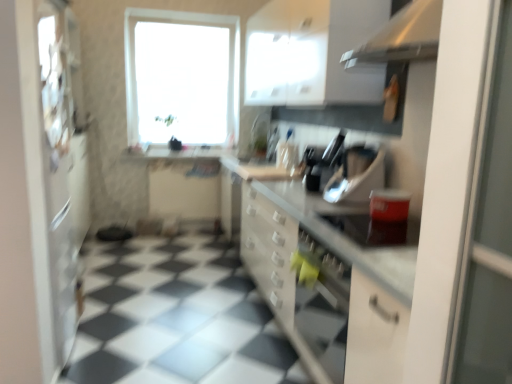
Question: From a real-world perspective, is metallic silver toaster at center, placed as the 2th appliance when sorted from front to back, on top of white glossy countertop at center?

Choices:
 (A) yes
 (B) no

Answer: (A)

Question: Does metallic silver toaster at center, placed as the 2th appliance when sorted from front to back, lie behind white glossy countertop at center?

Choices:
 (A) yes
 (B) no

Answer: (A)

Question: From the image's perspective, would you say metallic silver toaster at center, placed as the 2th appliance when sorted from front to back, is shown under white glossy countertop at center?

Choices:
 (A) yes
 (B) no

Answer: (B)

Question: Is metallic silver toaster at center, placed as the 2th appliance when sorted from front to back, taller than white glossy countertop at center?

Choices:
 (A) yes
 (B) no

Answer: (B)

Question: Is metallic silver toaster at center, which is counted as the second appliance, starting from the back, thinner than white glossy countertop at center?

Choices:
 (A) no
 (B) yes

Answer: (B)

Question: Is matte black toaster at center, the third appliance viewed from the back, spatially inside metallic silver toaster at center, which is counted as the second appliance, starting from the back, or outside of it?

Choices:
 (A) inside
 (B) outside

Answer: (B)

Question: Is matte black toaster at center, the third appliance viewed from the back, bigger or smaller than metallic silver toaster at center, placed as the 2th appliance when sorted from front to back?

Choices:
 (A) big
 (B) small

Answer: (B)

Question: Considering the positions of matte black toaster at center, the third appliance viewed from the back, and metallic silver toaster at center, placed as the 2th appliance when sorted from front to back, in the image, is matte black toaster at center, the third appliance viewed from the back, wider or thinner than metallic silver toaster at center, placed as the 2th appliance when sorted from front to back,?

Choices:
 (A) thin
 (B) wide

Answer: (B)

Question: Is point (353, 230) closer or farther from the camera than point (370, 157)?

Choices:
 (A) farther
 (B) closer

Answer: (B)

Question: From the image's perspective, is white glossy exhaust hood at upper right above or below transparent glass window at upper center?

Choices:
 (A) below
 (B) above

Answer: (A)

Question: Looking at their shapes, would you say white glossy exhaust hood at upper right is wider or thinner than transparent glass window at upper center?

Choices:
 (A) wide
 (B) thin

Answer: (A)

Question: Does point (402, 59) appear closer or farther from the camera than point (173, 23)?

Choices:
 (A) closer
 (B) farther

Answer: (A)

Question: Considering the positions of white glossy exhaust hood at upper right and transparent glass window at upper center in the image, is white glossy exhaust hood at upper right taller or shorter than transparent glass window at upper center?

Choices:
 (A) tall
 (B) short

Answer: (B)

Question: Considering the positions of white matte refrigerator at left and transparent glass window at upper center in the image, is white matte refrigerator at left wider or thinner than transparent glass window at upper center?

Choices:
 (A) wide
 (B) thin

Answer: (B)

Question: In the image, is white matte refrigerator at left on the left side or the right side of transparent glass window at upper center?

Choices:
 (A) left
 (B) right

Answer: (A)